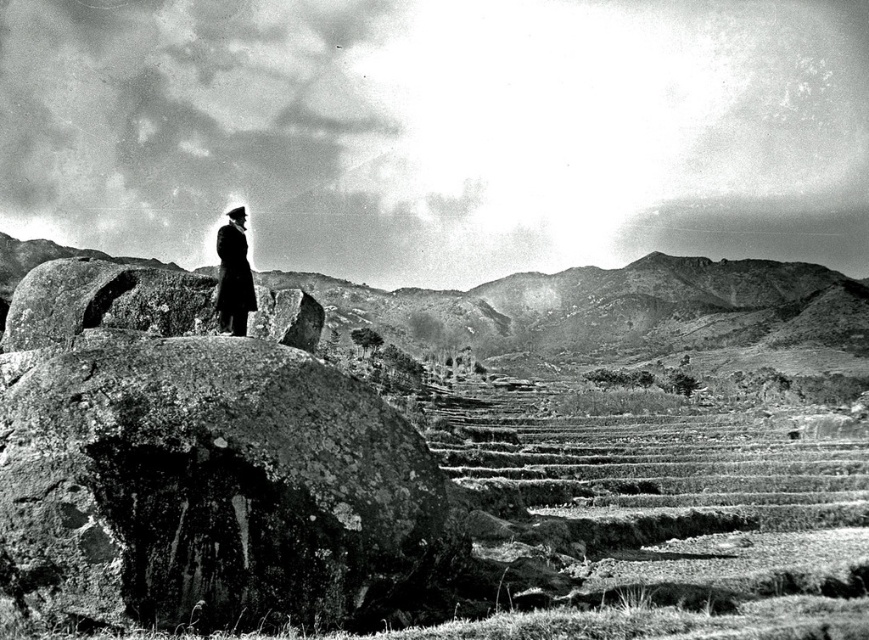
Question: Which of the following is the closest to the observer?

Choices:
 (A) dark wool coat at center
 (B) rough stone boulder at center-left

Answer: (B)

Question: From the image, what is the correct spatial relationship of rough stone boulder at center-left in relation to dark wool coat at center?

Choices:
 (A) right
 (B) left

Answer: (A)

Question: Is rough stone boulder at center-left further to camera compared to dark wool coat at center?

Choices:
 (A) yes
 (B) no

Answer: (B)

Question: Is the position of rough stone boulder at center-left more distant than that of dark wool coat at center?

Choices:
 (A) no
 (B) yes

Answer: (A)